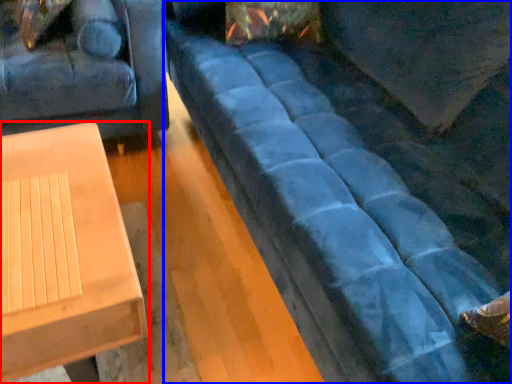
Question: Which object is closer to the camera taking this photo, table (highlighted by a red box) or studio couch (highlighted by a blue box)?

Choices:
 (A) table
 (B) studio couch

Answer: (B)